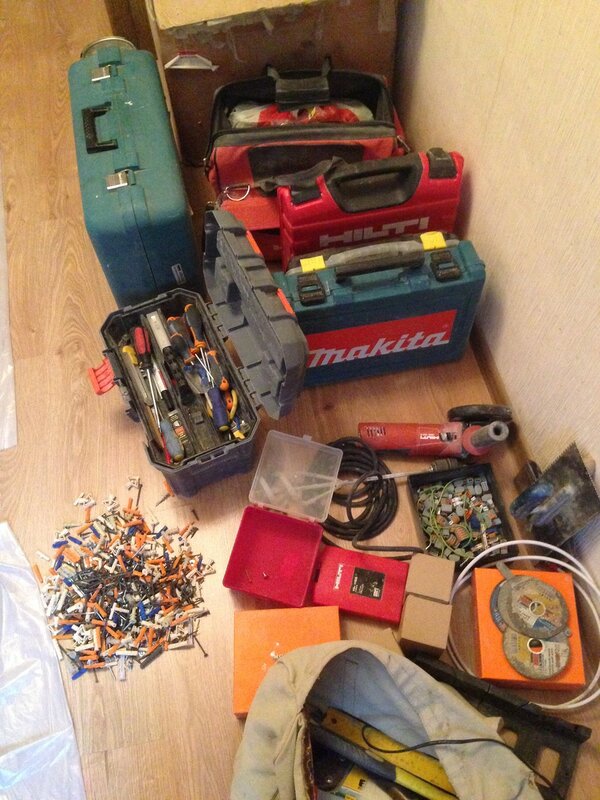
Identify the location of 1 cardboard box. pyautogui.click(x=202, y=18).